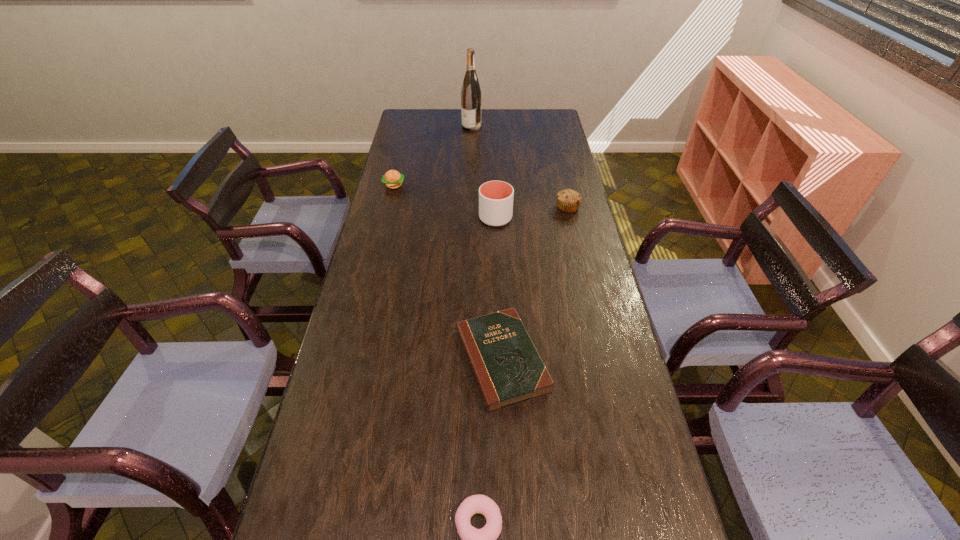
Identify the location of the farthest object. coord(471,93).

The width and height of the screenshot is (960, 540). I want to click on wine bottle, so click(x=471, y=93).

At what (x,y) coordinates should I click in order to perform the action: click on the fifth shortest object. Please return your answer as a coordinate pair (x, y). The height and width of the screenshot is (540, 960). Looking at the image, I should click on [x=495, y=197].

I want to click on the rightmost object, so click(568, 200).

Identify the location of the fifth nearest object. (393, 179).

In order to click on hamburger in this screenshot , I will do pos(393,179).

The width and height of the screenshot is (960, 540). In order to click on the second nearest object in this screenshot , I will do `click(508, 369)`.

Where is `free space located on the right of the wine bottle`? The image size is (960, 540). free space located on the right of the wine bottle is located at coordinates (551, 127).

Image resolution: width=960 pixels, height=540 pixels. In order to click on vacant position located on the left of the fifth shortest object in this screenshot , I will do `click(466, 218)`.

Locate an element on the screen. Image resolution: width=960 pixels, height=540 pixels. free space located 0.110m on the front of the muffin is located at coordinates (574, 233).